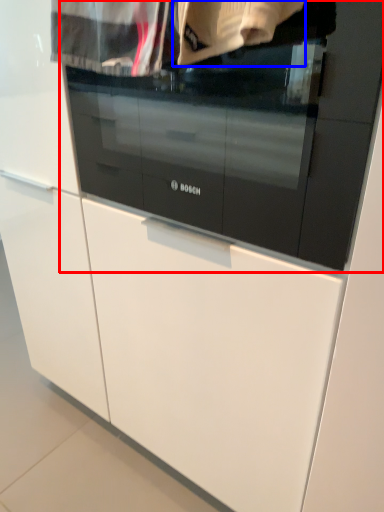
Question: Which of the following is the farthest to the observer, oven (highlighted by a red box) or clothing (highlighted by a blue box)?

Choices:
 (A) oven
 (B) clothing

Answer: (A)